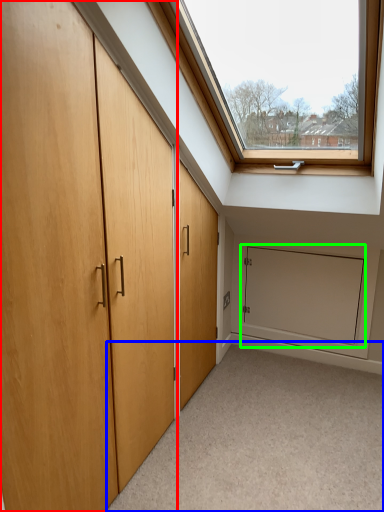
Question: Considering the real-world distances, which object is closest to door (highlighted by a red box)? corridor (highlighted by a blue box) or screen door (highlighted by a green box).

Choices:
 (A) corridor
 (B) screen door

Answer: (A)